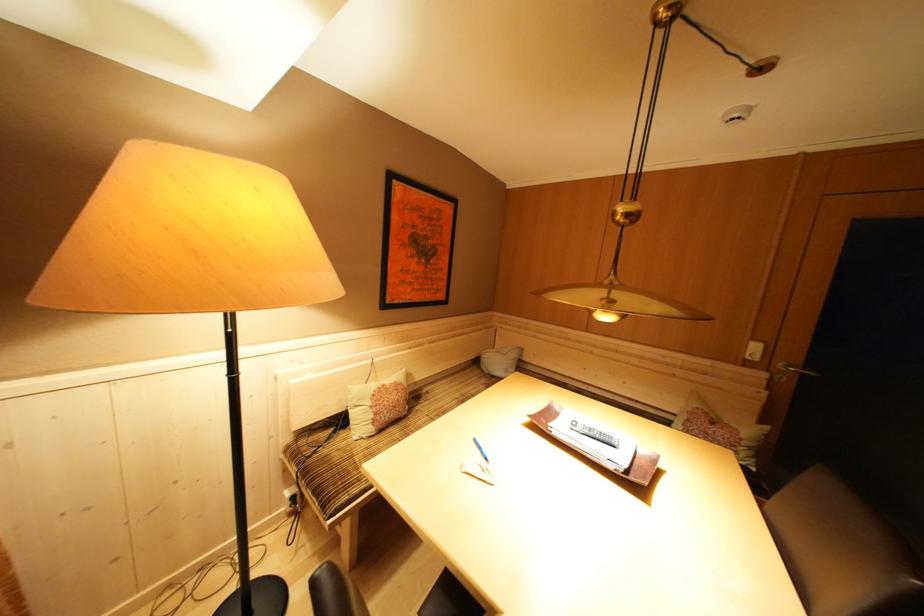
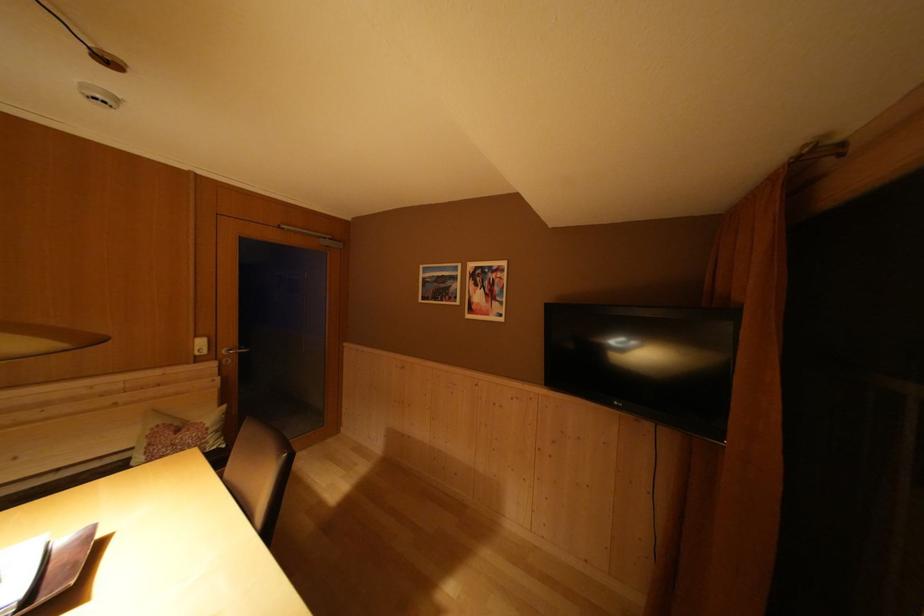
In the second image, find the point that corresponds to (759,344) in the first image.

(203, 342)